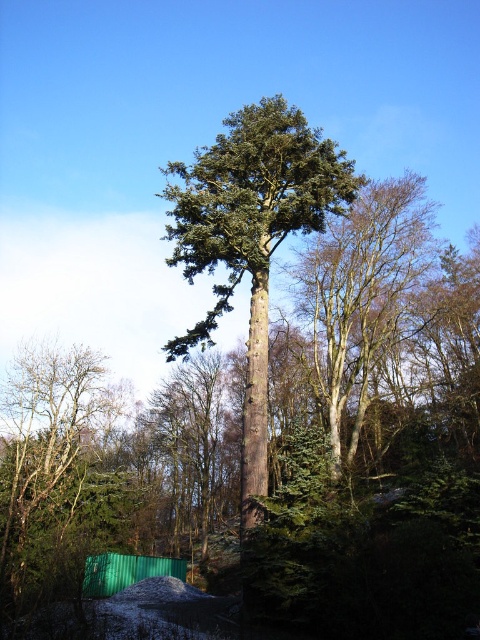
Which of these two, green textured tree at center or green rough bark tree at center, stands taller?

green textured tree at center is taller.

Can you confirm if green textured tree at center is taller than green rough bark tree at center?

Indeed, green textured tree at center has a greater height compared to green rough bark tree at center.

This screenshot has width=480, height=640. I want to click on green textured tree at center, so click(252, 236).

How far apart are green matte tree at lower left and green rough bark tree at center?

A distance of 51.71 feet exists between green matte tree at lower left and green rough bark tree at center.

I want to click on green matte tree at lower left, so click(x=56, y=474).

Is point (3, 522) more distant than point (397, 285)?

No, (3, 522) is closer to viewer.

Image resolution: width=480 pixels, height=640 pixels. I want to click on green matte tree at lower left, so click(56, 474).

Who is positioned more to the left, green textured tree at center or green matte tree at lower left?

green matte tree at lower left is more to the left.

Is green textured tree at center taller than green matte tree at lower left?

Indeed, green textured tree at center has a greater height compared to green matte tree at lower left.

Which is in front, point (213, 326) or point (112, 525)?

Point (213, 326)

Find the location of `green textured tree at center`. green textured tree at center is located at coordinates (252, 236).